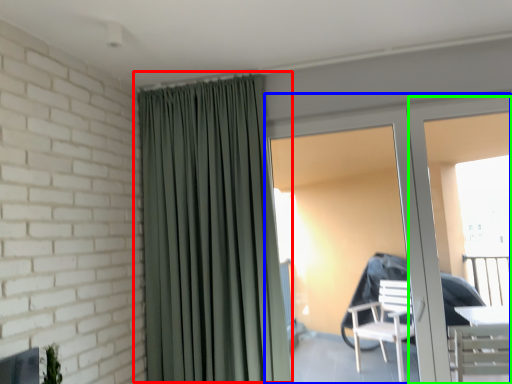
Question: Estimate the real-world distances between objects in this image. Which object is farther from curtain (highlighted by a red box), door (highlighted by a blue box) or screen door (highlighted by a green box)?

Choices:
 (A) door
 (B) screen door

Answer: (B)